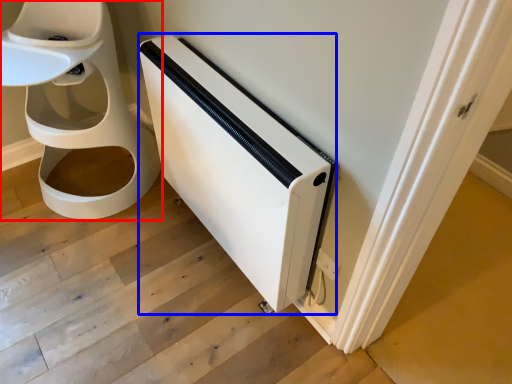
Question: Among these objects, which one is farthest to the camera, toilet (highlighted by a red box) or appliance (highlighted by a blue box)?

Choices:
 (A) toilet
 (B) appliance

Answer: (A)